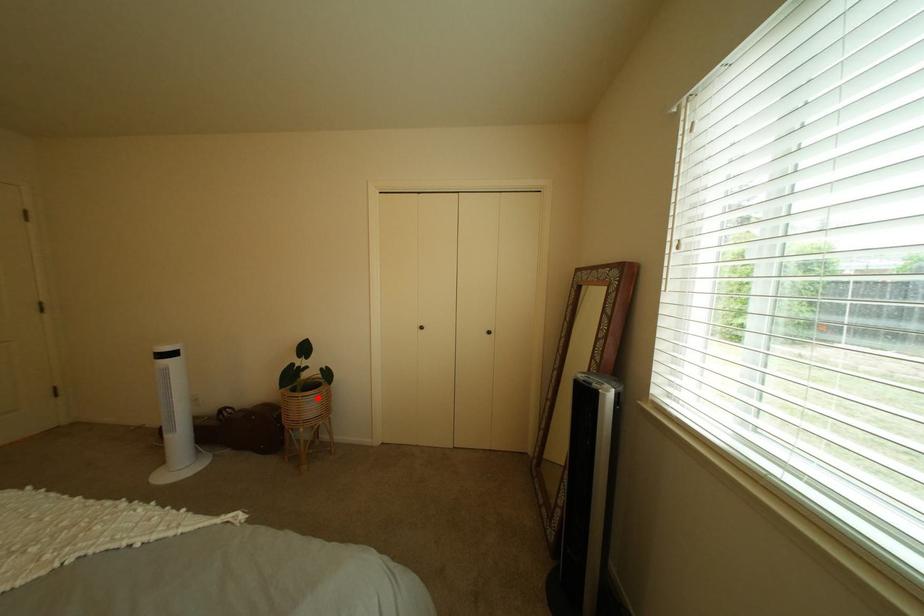
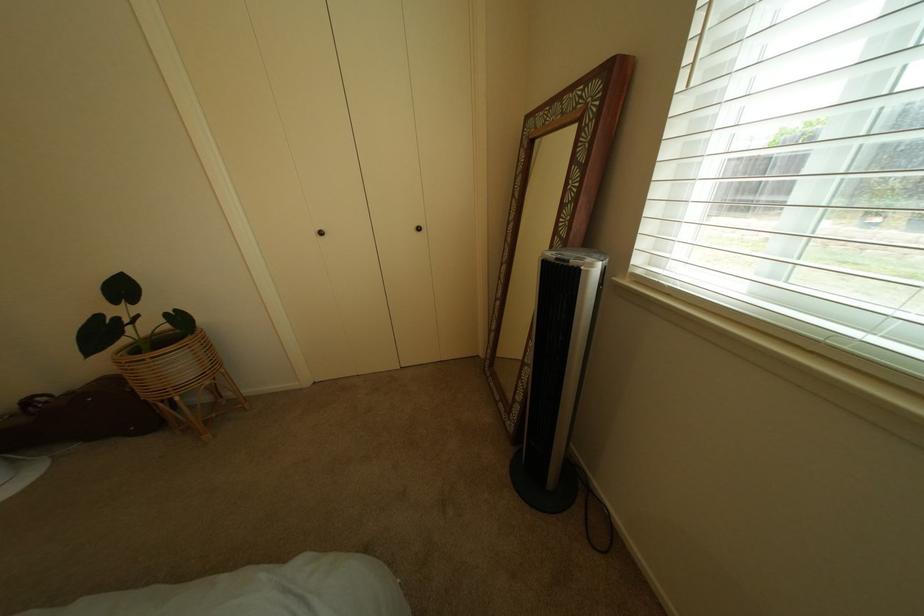
Question: A red point is marked in image1. In image2, is the corresponding 3D point closer to the camera or farther? Reply with the corresponding letter.

Choices:
 (A) The corresponding 3D point is closer.
 (B) The corresponding 3D point is farther.

Answer: (A)